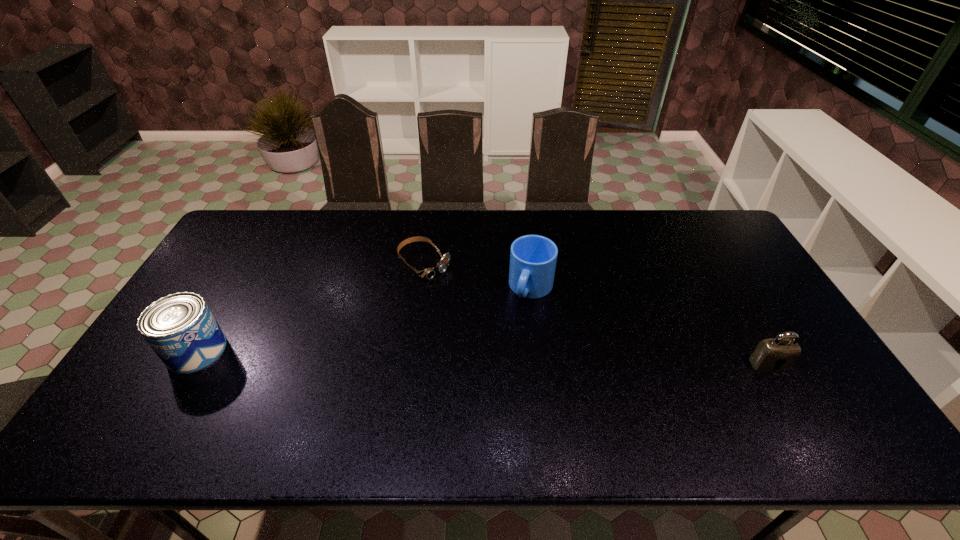
Locate an element on the screen. vacant space located on the front-facing side of the shortest object is located at coordinates (495, 328).

Where is `free location located 0.270m on the front-facing side of the shortest object`? This screenshot has height=540, width=960. free location located 0.270m on the front-facing side of the shortest object is located at coordinates (495, 328).

Find the location of a particular element. The height and width of the screenshot is (540, 960). object present at the far edge is located at coordinates (429, 273).

This screenshot has width=960, height=540. In order to click on object at the left edge in this screenshot , I will do `click(180, 328)`.

Where is `object present at the right edge`? Image resolution: width=960 pixels, height=540 pixels. object present at the right edge is located at coordinates (778, 354).

The image size is (960, 540). In order to click on free spot at the far edge of the desktop in this screenshot , I will do `click(340, 224)`.

What are the coordinates of `free spot at the near edge of the desktop` in the screenshot? It's located at (409, 384).

Find the location of a particular element. vacant space at the left edge is located at coordinates (233, 273).

Identify the location of vacant space at the right edge. Image resolution: width=960 pixels, height=540 pixels. (754, 328).

Image resolution: width=960 pixels, height=540 pixels. In the image, there is a desktop. What are the coordinates of `free space at the far left corner` in the screenshot? It's located at (261, 246).